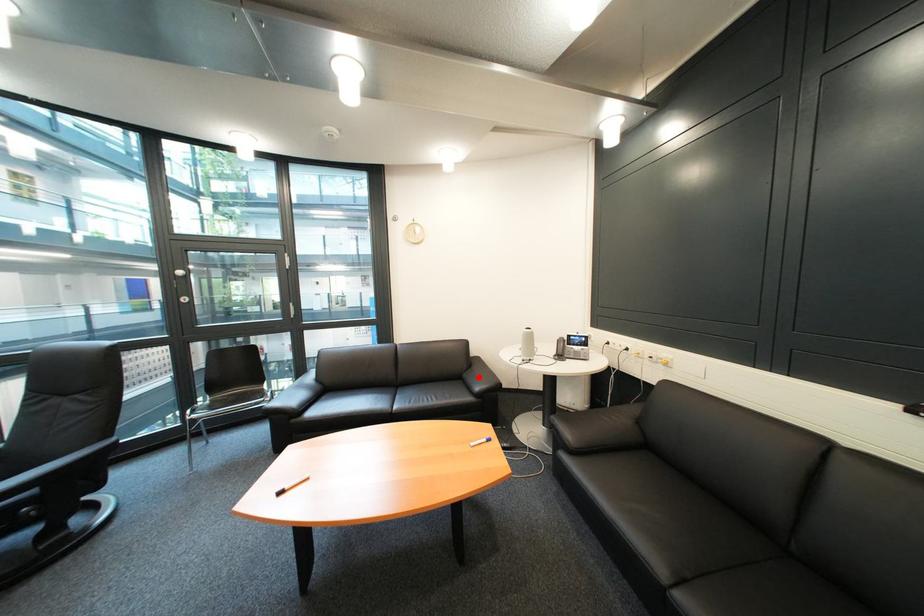
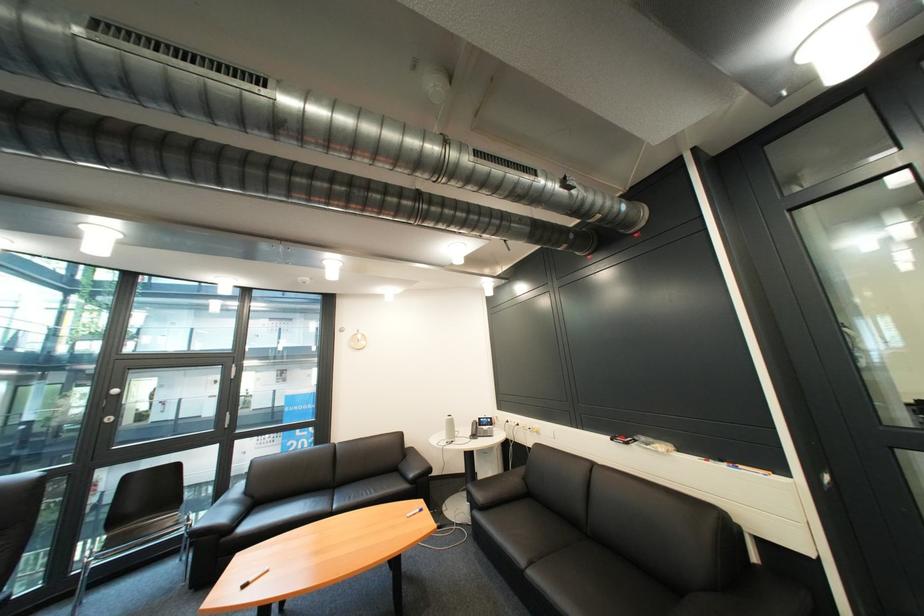
The point at the highlighted location is marked in the first image. Where is the corresponding point in the second image?

(414, 468)